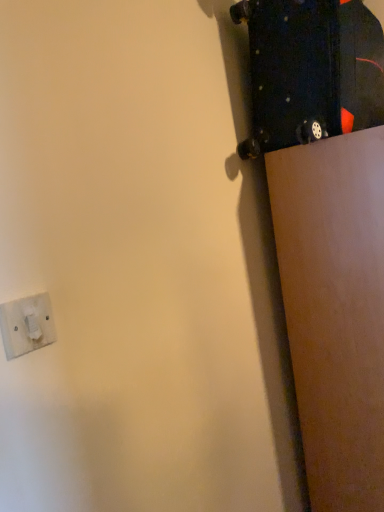
Question: In terms of height, does black matte skateboard at upper right look taller or shorter compared to white plastic socket at lower left?

Choices:
 (A) short
 (B) tall

Answer: (B)

Question: Is point (256, 72) positioned closer to the camera than point (49, 303)?

Choices:
 (A) closer
 (B) farther

Answer: (B)

Question: From the image's perspective, is black matte skateboard at upper right located above or below white plastic socket at lower left?

Choices:
 (A) above
 (B) below

Answer: (A)

Question: Looking at the image, does white plastic socket at lower left seem bigger or smaller compared to black matte skateboard at upper right?

Choices:
 (A) big
 (B) small

Answer: (B)

Question: In the image, is white plastic socket at lower left positioned in front of or behind black matte skateboard at upper right?

Choices:
 (A) behind
 (B) front

Answer: (B)

Question: Is point (31, 337) positioned closer to the camera than point (319, 5)?

Choices:
 (A) farther
 (B) closer

Answer: (B)

Question: In terms of width, does white plastic socket at lower left look wider or thinner when compared to black matte skateboard at upper right?

Choices:
 (A) wide
 (B) thin

Answer: (B)